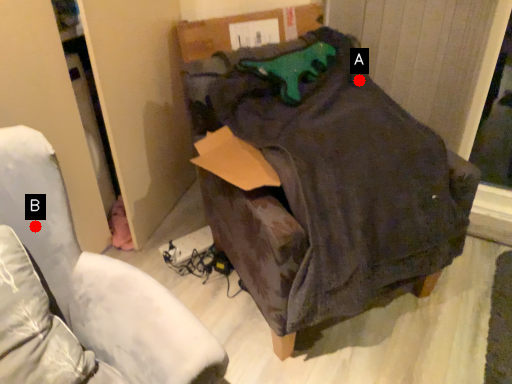
Question: Two points are circled on the image, labeled by A and B beside each circle. Which point appears farthest from the camera in this image?

Choices:
 (A) A is further
 (B) B is further

Answer: (A)